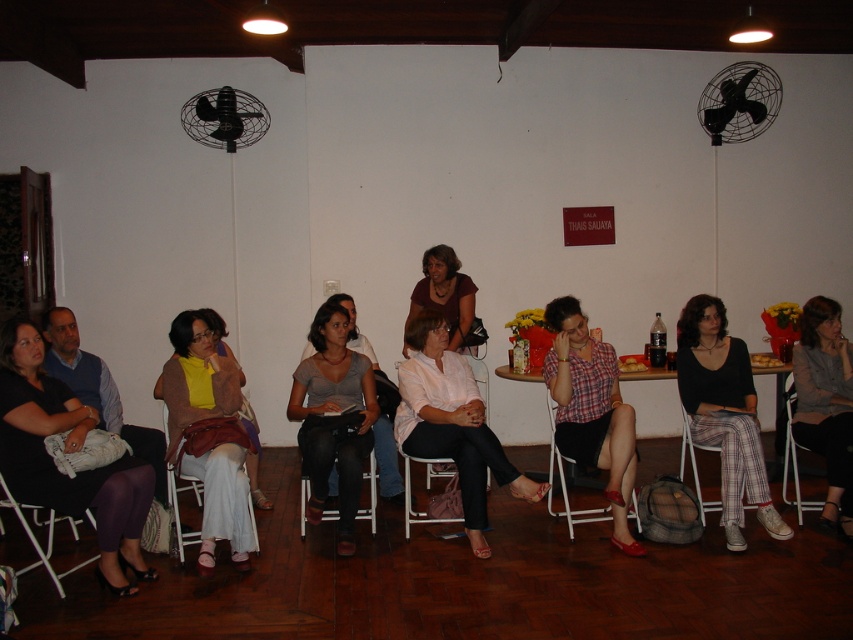
You are organizing a workshop and need to place a narrow laptop stand that requires a minimum width of 30 cm. You have two chairs available at the center of the venue, the matte white chairs at center and the black fabric chair at center. Which chair should you choose to place the laptop stand on?

The matte white chairs at center is thinner than the black fabric chair at center, so the black fabric chair at center has a wider surface and can accommodate the laptop stand requiring at least 30 cm width.